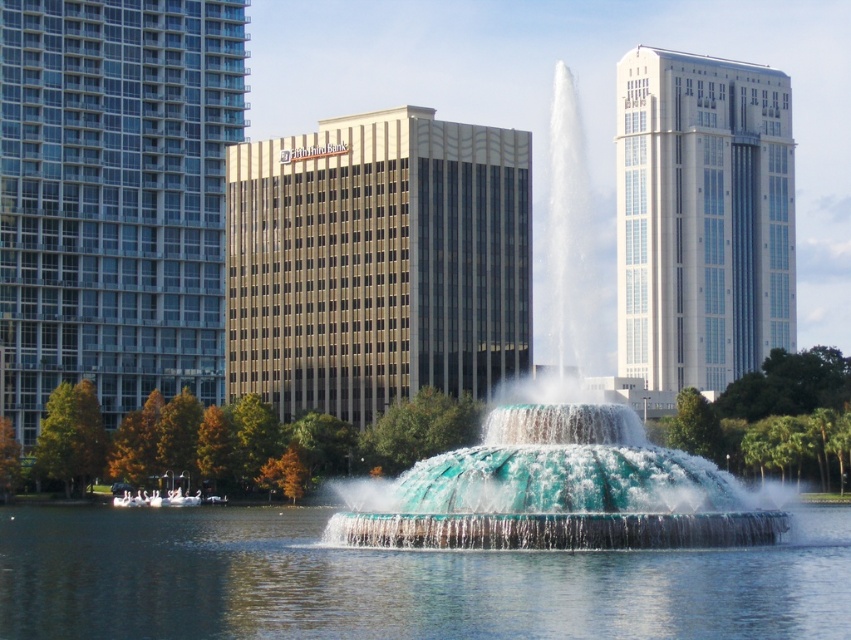
Can you confirm if clear water at center is smaller than translucent glass water at center?

Yes.

Who is higher up, clear water at center or translucent glass water at center?

translucent glass water at center is above.

Does point (615, 621) come closer to viewer compared to point (678, 472)?

That is True.

Image resolution: width=851 pixels, height=640 pixels. Identify the location of clear water at center. (397, 580).